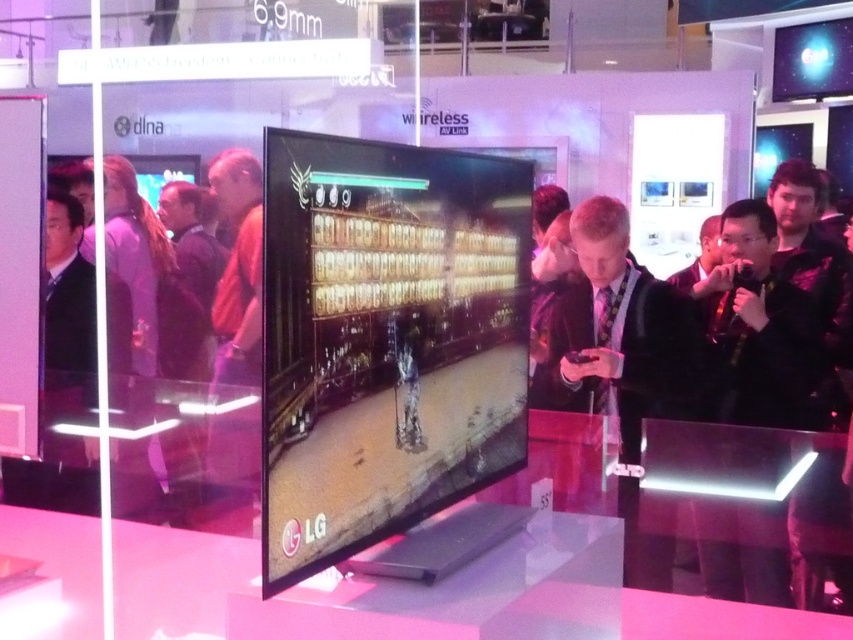
Consider the image. You are a photographer at the exhibition and want to capture both the black matte jacket at right and the black suit at center in a single shot. Since the camera can only focus on one subject at a time, which one should you focus on to ensure the other remains in the background?

A: The black matte jacket at right is located above the black suit at center, so focusing on the black suit at center would place the black matte jacket at right in the background.

You are a photographer at the exhibition and want to take a photo of both the black matte jacket at right and the black suit at center. Which one should you focus on first to ensure both are in sharp focus?

You should focus on the black suit at center first because it is farther away than the black matte jacket at right, so adjusting focus from far to near will help ensure both are sharp.

You are a photographer at the exhibition and want to capture a clear photo of the LG television screen without any reflections. You notice the black matte jacket at right in your frame. Based on its position, can you estimate whether it will block the light source causing reflections on the TV screen?

The black matte jacket at right is positioned at point (756, 326). Without knowing the exact location of the light source, it is impossible to determine if the jacket will block the light causing reflections on the TV screen.